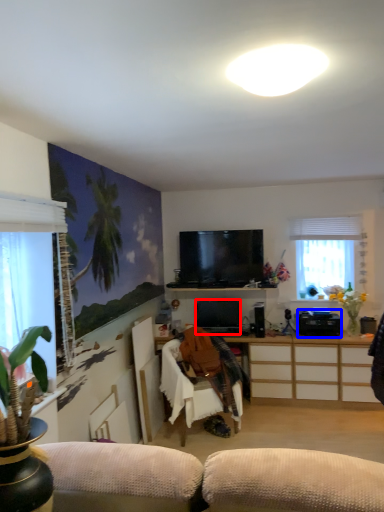
Question: Which point is further to the camera, television (highlighted by a red box) or appliance (highlighted by a blue box)?

Choices:
 (A) television
 (B) appliance

Answer: (A)